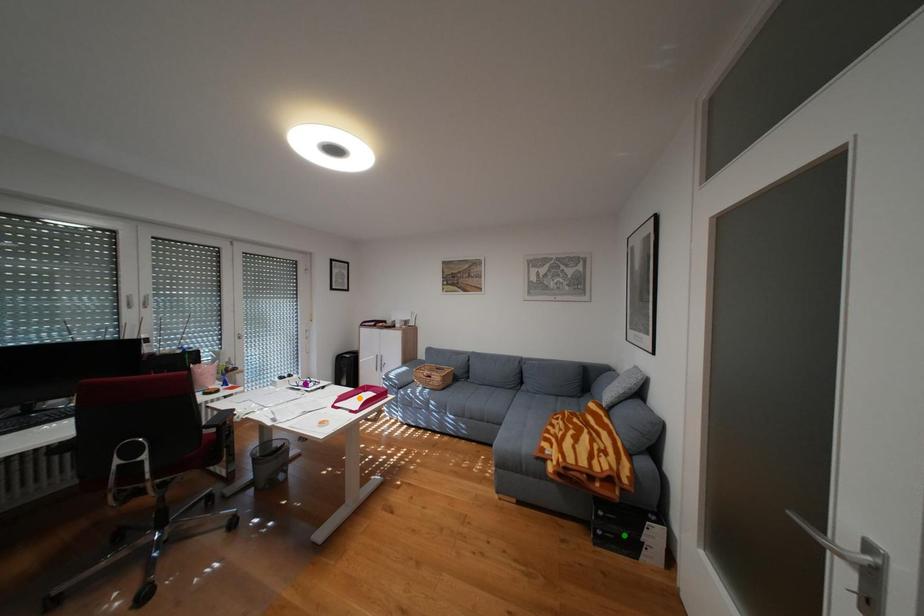
Order these from nearest to farthest:
1. purple point
2. orange point
3. green point

green point
orange point
purple point